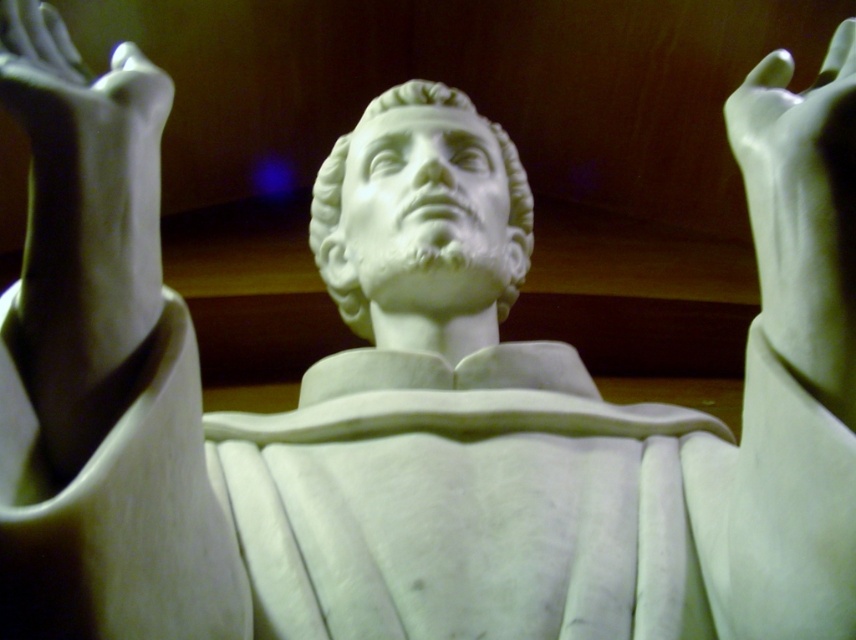
You are an art restorer examining the statue. You notice the white marble hand at upper right and the white marble bust at center. Which object is located to the right of the other?

The white marble hand at upper right is positioned on the right side of the white marble bust at center.